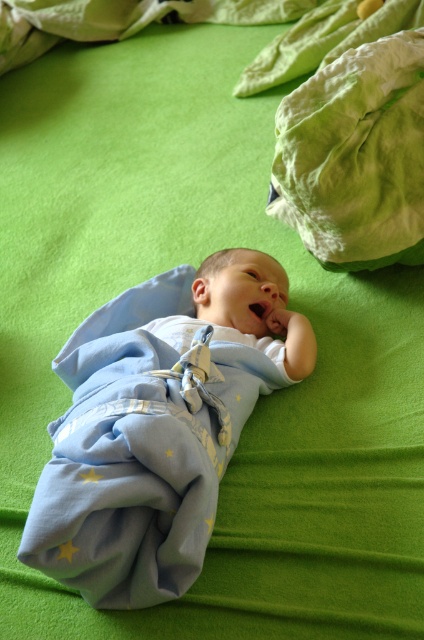
You are a photographer setting up a shoot for a baby product catalog. You need to ensure that the blue soft swaddle at center and the green cotton cloth at upper right are both visible in the frame. Given their sizes, which object should you position closer to the camera to maintain their visibility without overlapping?

The blue soft swaddle at center is wider than the green cotton cloth at upper right. To maintain visibility without overlapping, position the blue soft swaddle at center closer to the camera since its larger size can better fill the frame while keeping the green cotton cloth at upper right visible in the background.

You are a photographer setting up a shoot for a baby product catalog. You need to ensure the blue soft swaddle at center and the green cotton cloth at upper right are visible in the frame. Based on their positions, which object should you adjust to avoid blocking the other?

The blue soft swaddle at center is positioned on the left side of green cotton cloth at upper right. To avoid blocking the green cotton cloth at upper right, you should adjust the blue soft swaddle at center to move it further left or the green cotton cloth at upper right to move it further right.